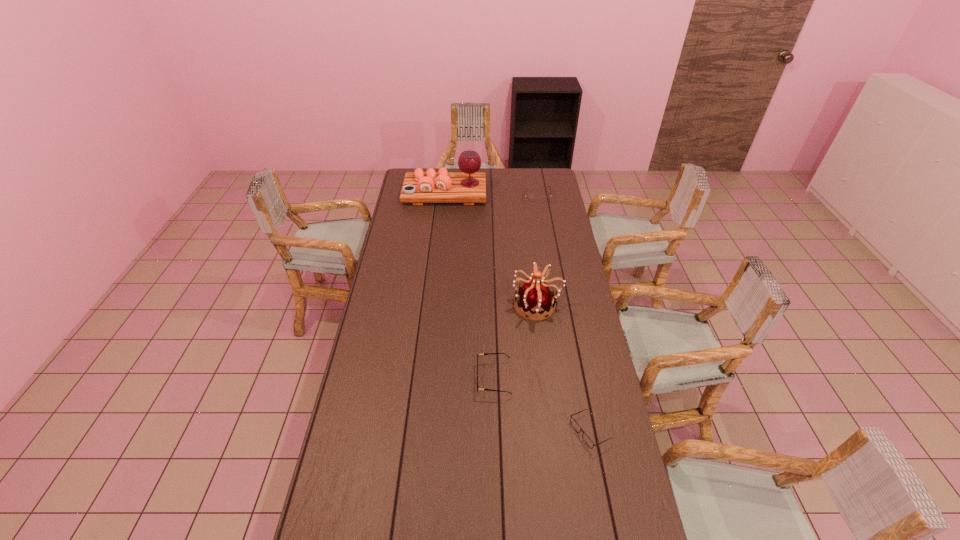
Select which object is the fourth closest to the tiara. Please provide its 2D coordinates. Your answer should be formatted as a tuple, i.e. [(x, y)], where the tuple contains the x and y coordinates of a point satisfying the conditions above.

[(530, 199)]

Identify which object is located as the third nearest to the platter. Please provide its 2D coordinates. Your answer should be formatted as a tuple, i.e. [(x, y)], where the tuple contains the x and y coordinates of a point satisfying the conditions above.

[(483, 353)]

Identify the location of the second closest spectacles relative to the nearest spectacles. (530, 199).

Locate an element on the screen. Image resolution: width=960 pixels, height=540 pixels. the closest spectacles to the leftmost spectacles is located at coordinates (575, 425).

Where is `vacant point that satisfies the following two spatial constraints: 1. on the front-facing side of the farthest spectacles; 2. on the front-facing side of the second nearest object`? vacant point that satisfies the following two spatial constraints: 1. on the front-facing side of the farthest spectacles; 2. on the front-facing side of the second nearest object is located at coordinates (567, 379).

Locate an element on the screen. The image size is (960, 540). free spot that satisfies the following two spatial constraints: 1. on the front-facing side of the farthest spectacles; 2. on the front-facing side of the second nearest object is located at coordinates (567, 379).